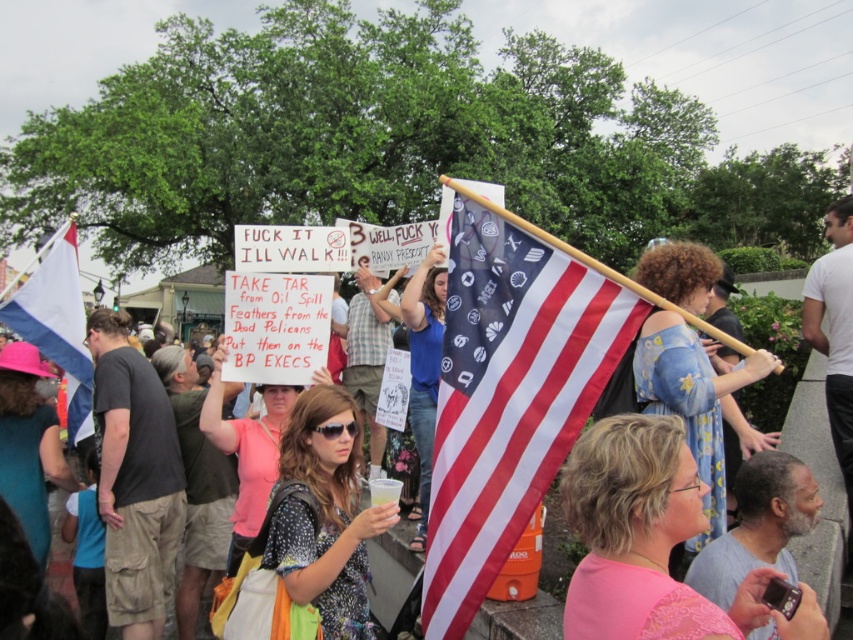
You are a photographer at the protest scene. You want to capture a photo of the pink lace dress at center without the american flag at center blocking it. What should you do?

The american flag at center is positioned over the pink lace dress at center, so you should move the flag or reposition yourself to capture the dress without obstruction.

You are a photographer at the protest scene. You want to take a photo that includes both the american flag at center and the pink lace dress at center. Which object should you position closer to the camera to ensure both are fully visible in the frame?

The american flag at center is much taller than the pink lace dress at center, so you should position the pink lace dress at center closer to the camera to ensure both are fully visible in the frame.